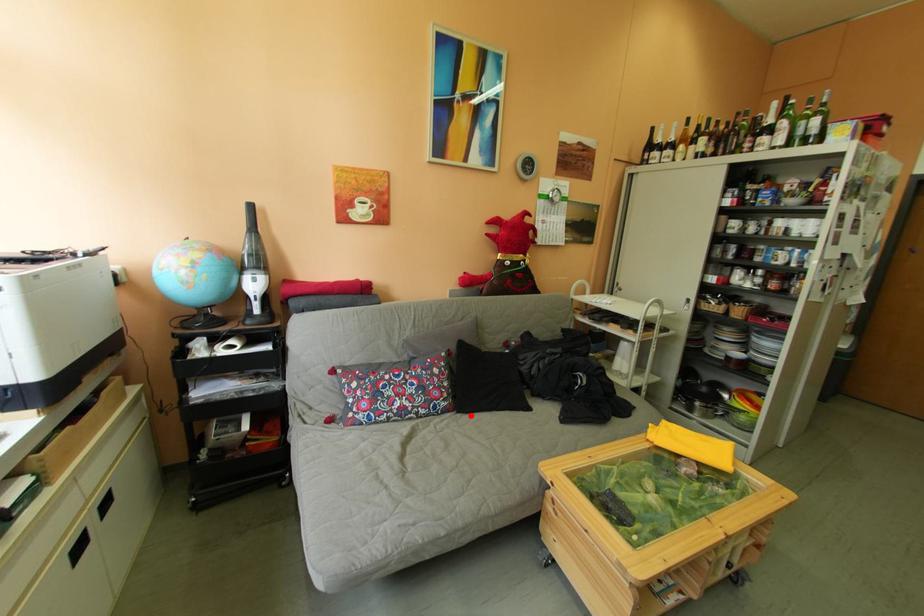
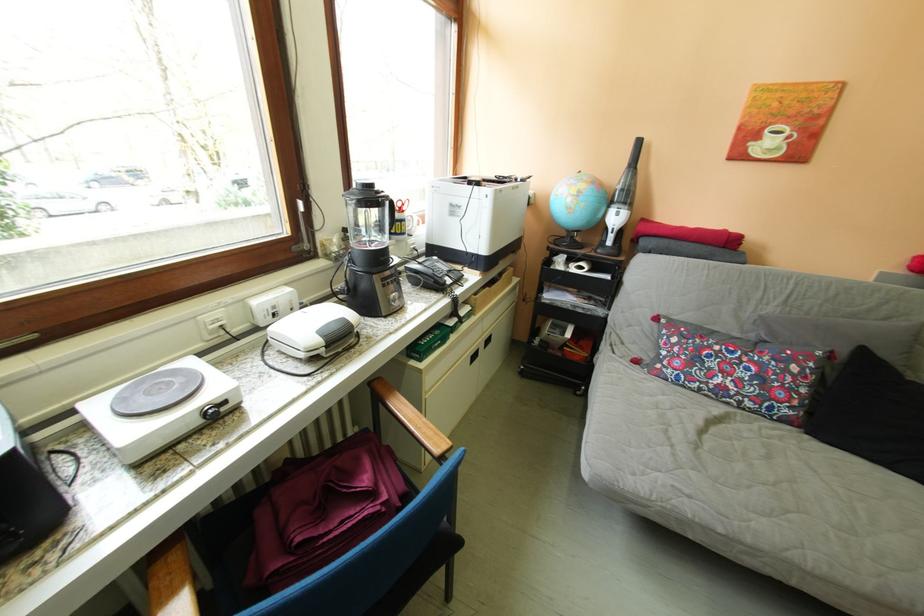
Question: I am providing you with two images of the same scene from different viewpoints. A red point is marked on the first image. At the location where the point appears in image 1, is it still visible in image 2?

Choices:
 (A) Yes
 (B) No

Answer: (A)